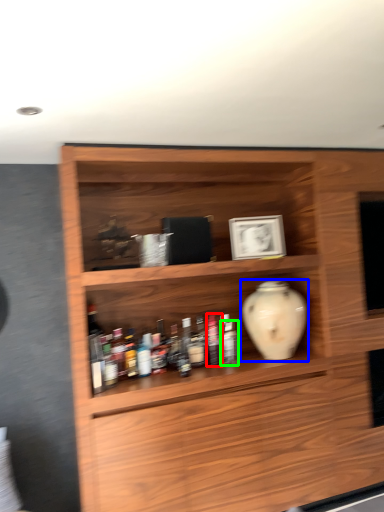
Question: Which object is positioned closest to bottle (highlighted by a red box)? Select from vase (highlighted by a blue box) and bottle (highlighted by a green box).

Choices:
 (A) vase
 (B) bottle

Answer: (B)